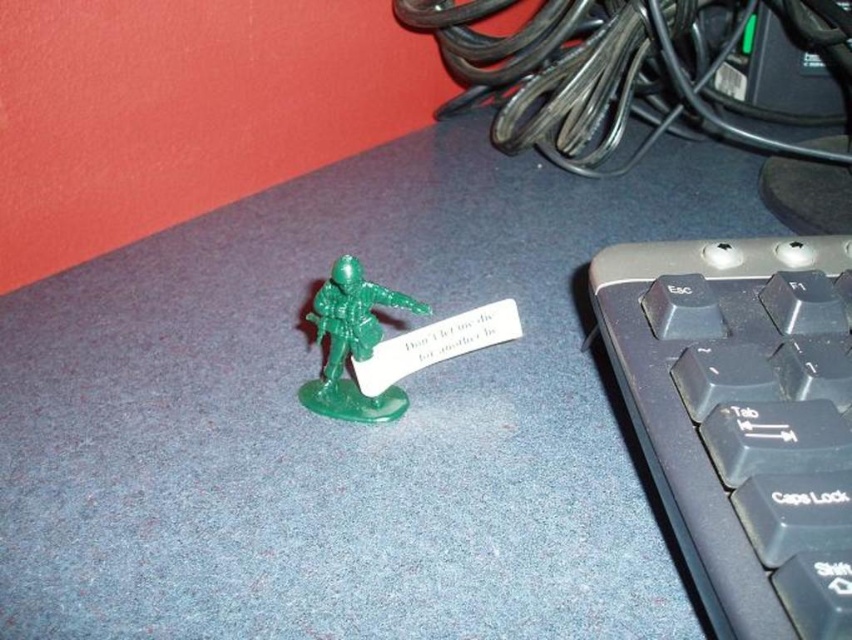
Question: Is black plastic keyboard at right above green plastic toy soldier at center?

Choices:
 (A) yes
 (B) no

Answer: (B)

Question: Does black plastic keyboard at right appear over green plastic toy soldier at center?

Choices:
 (A) yes
 (B) no

Answer: (B)

Question: Which of the following is the closest to the observer?

Choices:
 (A) (361, 310)
 (B) (847, 384)

Answer: (B)

Question: Observing the image, what is the correct spatial positioning of black plastic keyboard at right in reference to green plastic toy soldier at center?

Choices:
 (A) right
 (B) left

Answer: (A)

Question: Which object is farther from the camera taking this photo?

Choices:
 (A) green plastic toy soldier at center
 (B) black plastic keyboard at right

Answer: (A)